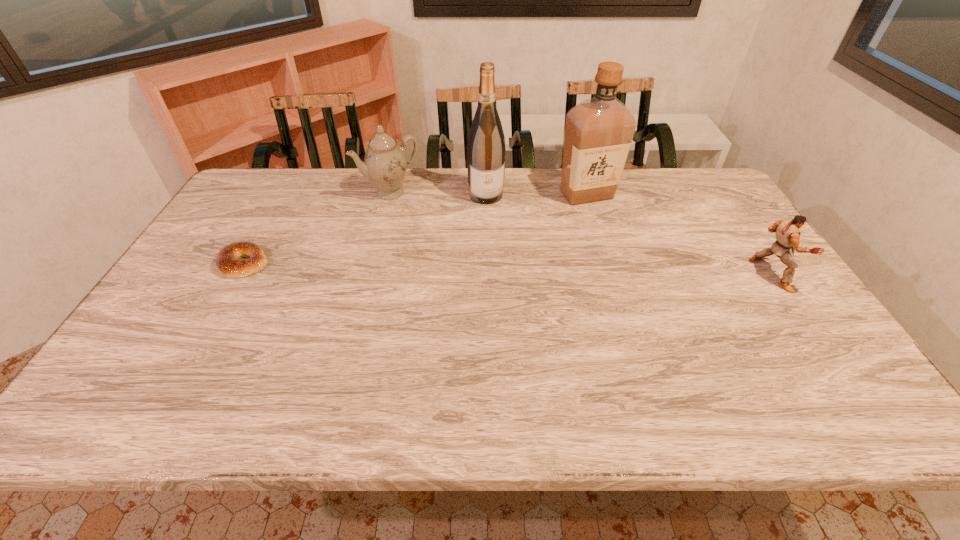
Find the location of a particular element. The height and width of the screenshot is (540, 960). vacant space situated 0.340m on the spout of the third tallest object is located at coordinates (449, 263).

This screenshot has width=960, height=540. I want to click on vacant region located on the spout of the third tallest object, so click(424, 231).

The width and height of the screenshot is (960, 540). Find the location of `blank space located 0.130m on the front-facing side of the liquor`. blank space located 0.130m on the front-facing side of the liquor is located at coordinates (576, 231).

The height and width of the screenshot is (540, 960). Identify the location of vacant position located 0.320m on the front-facing side of the liquor. (565, 272).

At what (x,y) coordinates should I click in order to perform the action: click on vacant space located 0.290m on the front-facing side of the liquor. Please return your answer as a coordinate pair (x, y). The height and width of the screenshot is (540, 960). Looking at the image, I should click on pyautogui.click(x=567, y=265).

Identify the location of vacant space located on the label of the wine bottle. (493, 224).

This screenshot has width=960, height=540. Identify the location of free region located 0.260m on the label of the wine bottle. (502, 257).

Identify the location of vacant space located 0.310m on the label of the wine bottle. The image size is (960, 540). (505, 269).

This screenshot has width=960, height=540. Identify the location of chinaware at the far edge. (385, 163).

The image size is (960, 540). What are the coordinates of `liquor present at the far edge` in the screenshot? It's located at (599, 131).